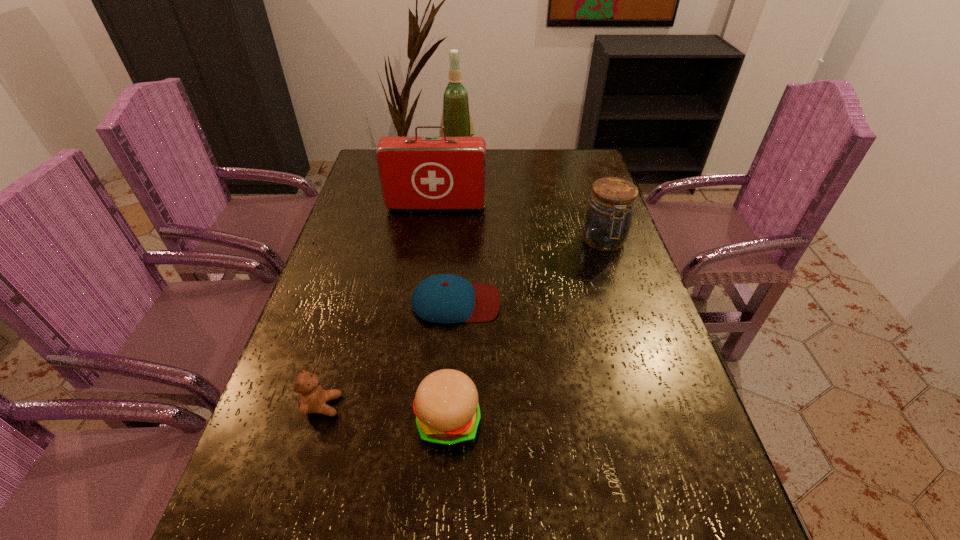
Find the location of `empty space that is in between the third tallest object and the fourth farthest object`. empty space that is in between the third tallest object and the fourth farthest object is located at coordinates (530, 272).

You are a GUI agent. You are given a task and a screenshot of the screen. Output one action in this format:
    pyautogui.click(x=<x>, y=<y>)
    Task: Click on the free space between the shortest object and the teddy bear
    Image resolution: width=960 pixels, height=540 pixels.
    Given the screenshot: What is the action you would take?
    pyautogui.click(x=389, y=354)

Identify the location of object identified as the second closest to the second farthest object. (607, 222).

Select which object appears as the fourth closest to the fifth nearest object. Please provide its 2D coordinates. Your answer should be formatted as a tuple, i.e. [(x, y)], where the tuple contains the x and y coordinates of a point satisfying the conditions above.

[(312, 398)]

In order to click on free location that satisfies the following two spatial constraints: 1. on the back side of the hamburger; 2. on the face of the teddy bear in this screenshot , I will do `click(449, 406)`.

The image size is (960, 540). What are the coordinates of `blank space that satisfies the following two spatial constraints: 1. on the side of the second farthest object with the first aid cross symbol; 2. on the face of the teddy bear` in the screenshot? It's located at (410, 406).

Where is `vacant space that satisfies the following two spatial constraints: 1. on the front-facing side of the hamburger; 2. on the left side of the wine bottle`? Image resolution: width=960 pixels, height=540 pixels. vacant space that satisfies the following two spatial constraints: 1. on the front-facing side of the hamburger; 2. on the left side of the wine bottle is located at coordinates pyautogui.click(x=438, y=421).

What are the coordinates of `vacant area in the image that satisfies the following two spatial constraints: 1. on the face of the teddy bear; 2. on the back side of the hamburger` in the screenshot? It's located at [318, 421].